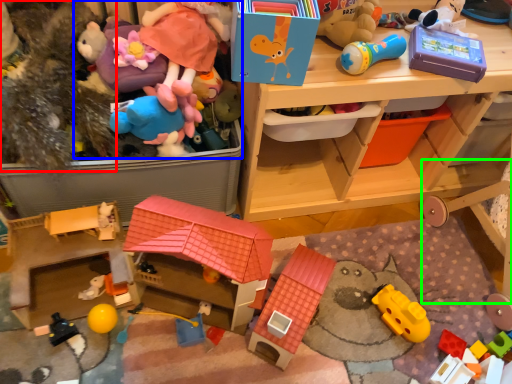
Question: Which object is the farthest from toy (highlighted by a red box)? Choose among these: toy (highlighted by a blue box) or bunk bed (highlighted by a green box).

Choices:
 (A) toy
 (B) bunk bed

Answer: (B)